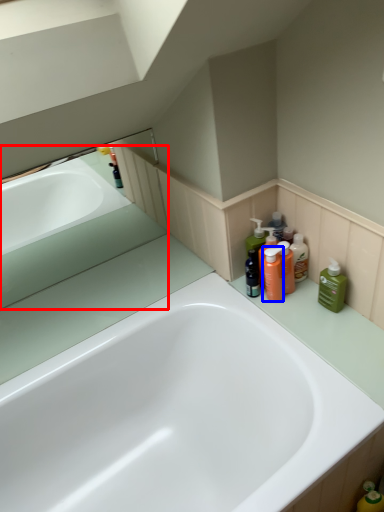
Question: Which point is closer to the camera, bath (highlighted by a red box) or cleaning product (highlighted by a blue box)?

Choices:
 (A) bath
 (B) cleaning product

Answer: (B)